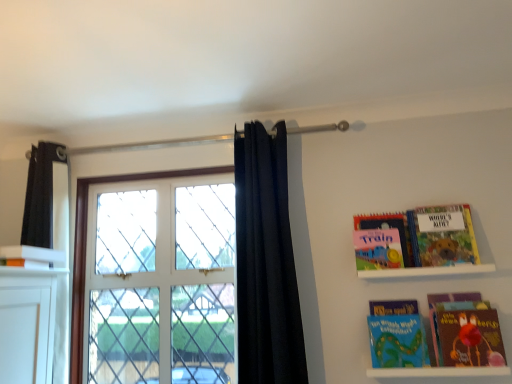
Identify the location of free point above white glass window at center (from a real-world perspective). (166, 164).